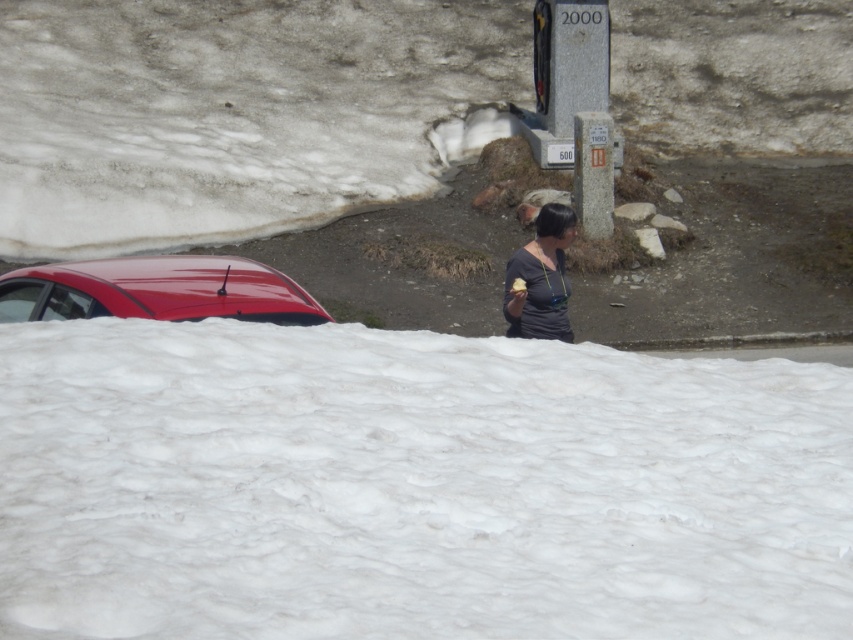
You are a delivery person who needs to place a package on the white fluffy snow at lower center. You are currently standing at the dark gray matte shirt at center. Is the distance between you and the snow sufficient to comfortably walk over and place the package without slipping?

The distance between the white fluffy snow at lower center and the dark gray matte shirt at center is 3.10 meters, which is a comfortable distance for walking over and placing the package without slipping.

You are standing at the point marked by coordinates point (167,289) in a snowy landscape. What object are you currently standing on?

The point (167,289) is on glossy red car at upper left, so you are standing on the glossy red car at upper left.

You are standing at the point labeled point (x=77, y=269) and want to walk to the point labeled point (x=560, y=332). Which direction should you move relative to your current position?

You should move towards the upper right direction because point (x=560, y=332) is located above and to the right of point (x=77, y=269).